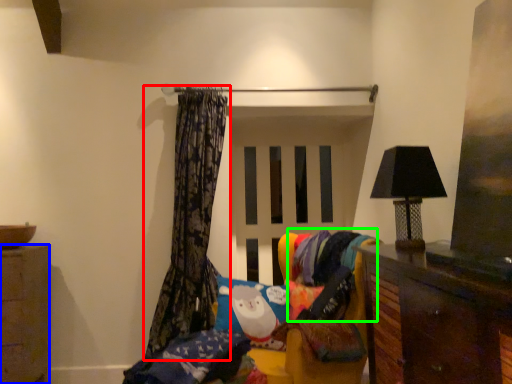
Question: Based on their relative distances, which object is nearer to curtain (highlighted by a red box)? Choose from cabinetry (highlighted by a blue box) and fabric (highlighted by a green box).

Choices:
 (A) cabinetry
 (B) fabric

Answer: (B)